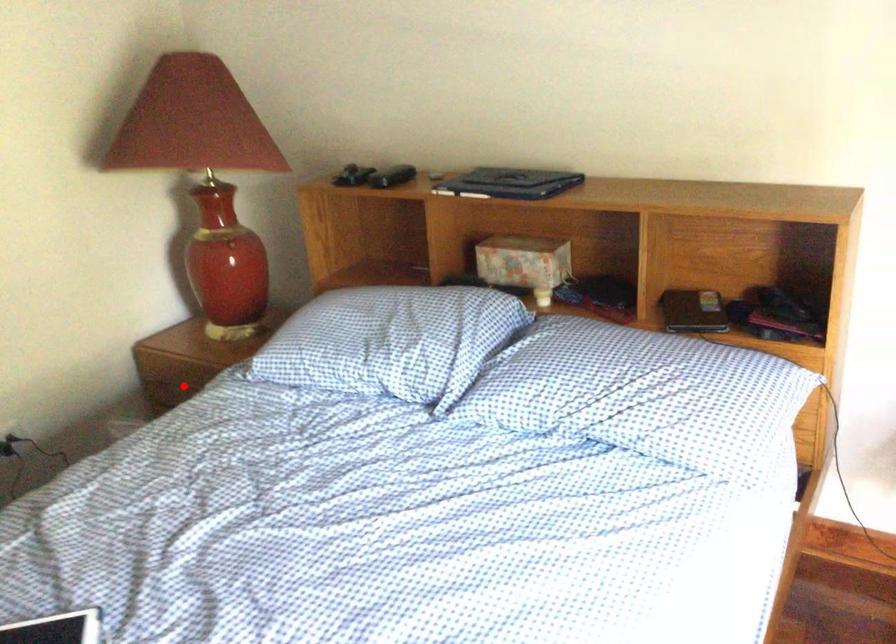
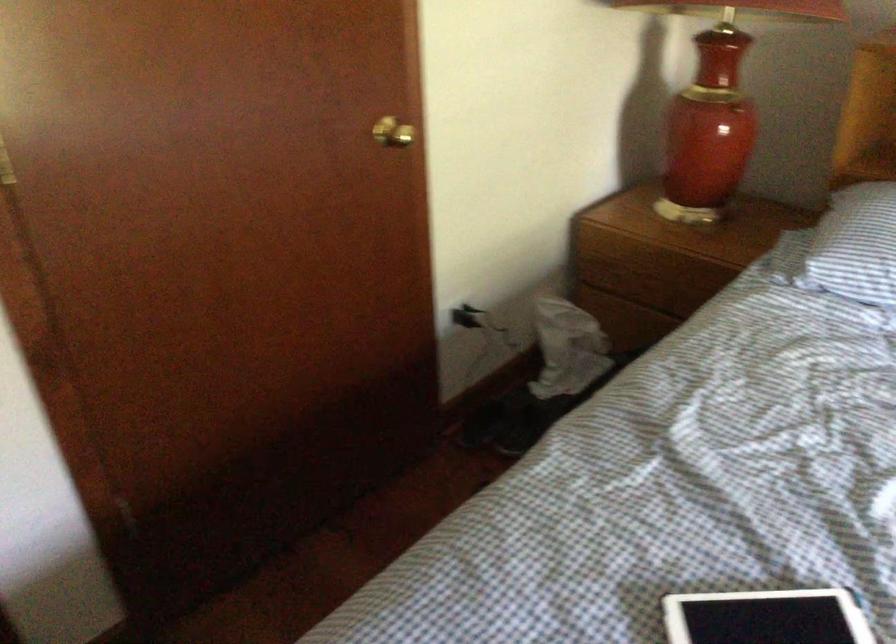
Question: I am providing you with two images of the same scene from different viewpoints. Image1 has a red point marked. In image2, the corresponding 3D location appears at what relative position? Reply with the corresponding letter.

Choices:
 (A) Closer
 (B) Farther

Answer: (A)